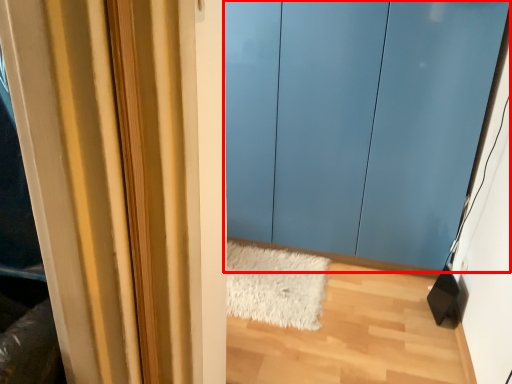
Question: From the image's perspective, what is the correct spatial positioning of door (annotated by the red box) in reference to doormat?

Choices:
 (A) below
 (B) above

Answer: (B)